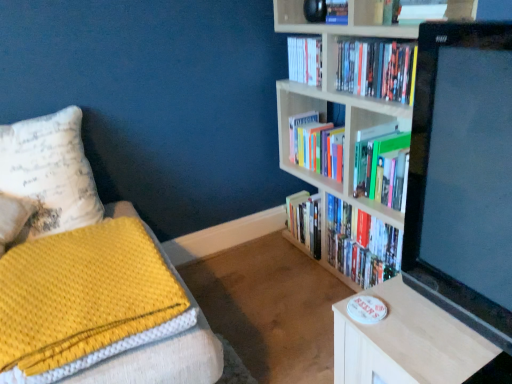
Question: Is white paperback book at upper center, the 2th book in the back-to-front sequence, oriented towards white matte bookcase at upper right?

Choices:
 (A) no
 (B) yes

Answer: (B)

Question: Is white paperback book at upper center, the 3th book from the front, far away from white matte bookcase at upper right?

Choices:
 (A) yes
 (B) no

Answer: (B)

Question: From a real-world perspective, is white paperback book at upper center, the 2th book in the back-to-front sequence, positioned under white matte bookcase at upper right based on gravity?

Choices:
 (A) yes
 (B) no

Answer: (B)

Question: Can you confirm if white paperback book at upper center, the 3th book from the front, is taller than white matte bookcase at upper right?

Choices:
 (A) no
 (B) yes

Answer: (A)

Question: Does white paperback book at upper center, the 2th book in the back-to-front sequence, appear on the right side of white matte bookcase at upper right?

Choices:
 (A) yes
 (B) no

Answer: (B)

Question: Considering the positions of white matte bookcase at upper right and black glossy monitor at upper right in the image, is white matte bookcase at upper right wider or thinner than black glossy monitor at upper right?

Choices:
 (A) wide
 (B) thin

Answer: (A)

Question: Do you think white matte bookcase at upper right is within black glossy monitor at upper right, or outside of it?

Choices:
 (A) outside
 (B) inside

Answer: (A)

Question: Is white matte bookcase at upper right bigger or smaller than black glossy monitor at upper right?

Choices:
 (A) big
 (B) small

Answer: (A)

Question: Is point (358, 4) positioned closer to the camera than point (470, 125)?

Choices:
 (A) farther
 (B) closer

Answer: (A)

Question: From the image's perspective, relative to white paperback book at upper center, the 2th book in the back-to-front sequence, is white matte bookcase at upper right above or below?

Choices:
 (A) below
 (B) above

Answer: (A)

Question: Which is correct: white matte bookcase at upper right is inside white paperback book at upper center, the 3th book from the front, or outside of it?

Choices:
 (A) inside
 (B) outside

Answer: (B)

Question: Is white matte bookcase at upper right to the left or to the right of white paperback book at upper center, the 3th book from the front, in the image?

Choices:
 (A) left
 (B) right

Answer: (B)

Question: Does point (379, 26) appear closer or farther from the camera than point (293, 69)?

Choices:
 (A) farther
 (B) closer

Answer: (B)

Question: From a real-world perspective, is hardcover books at upper right, the 2th book positioned from the front, physically located above or below white paperback book at upper center, the 3th book from the front?

Choices:
 (A) below
 (B) above

Answer: (A)

Question: Visually, is hardcover books at upper right, the 2th book positioned from the front, positioned to the left or to the right of white paperback book at upper center, the 3th book from the front?

Choices:
 (A) right
 (B) left

Answer: (A)